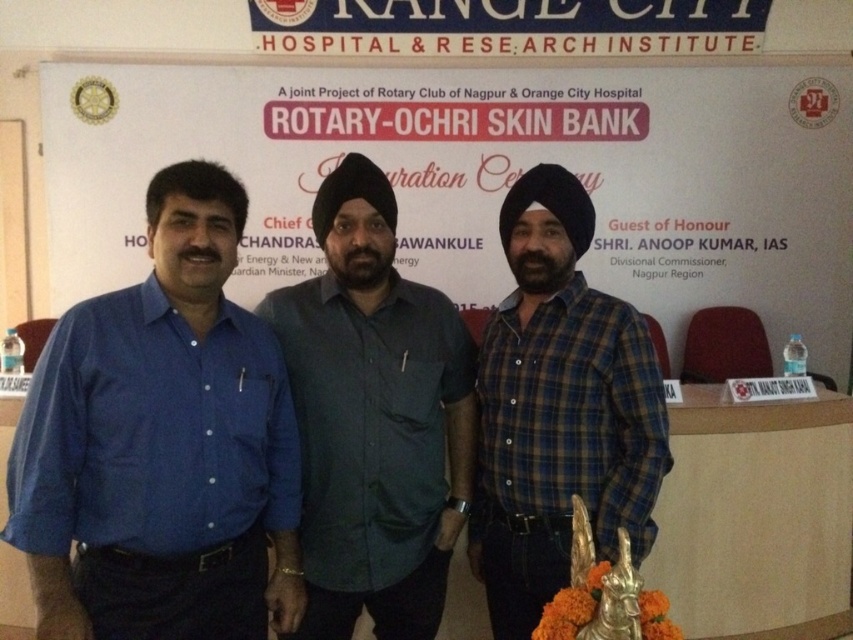
Does dark grey shirt at center have a lesser width compared to blue plaid shirt at center?

No, dark grey shirt at center is not thinner than blue plaid shirt at center.

How far apart are dark grey shirt at center and blue plaid shirt at center?

A distance of 12.22 inches exists between dark grey shirt at center and blue plaid shirt at center.

Image resolution: width=853 pixels, height=640 pixels. Describe the element at coordinates (374, 419) in the screenshot. I see `dark grey shirt at center` at that location.

I want to click on dark grey shirt at center, so click(374, 419).

Find the location of a particular element. white paper at center is located at coordinates click(485, 177).

Does point (146, 100) come in front of point (270, 384)?

That is False.

Describe the element at coordinates (485, 177) in the screenshot. I see `white paper at center` at that location.

Locate an element on the screen. The width and height of the screenshot is (853, 640). white paper at center is located at coordinates (485, 177).

Consider the image. Is white paper at center smaller than blue plaid shirt at center?

No.

Is point (845, 352) farther from camera compared to point (527, 291)?

Yes, point (845, 352) is behind point (527, 291).

Identify the location of white paper at center. (485, 177).